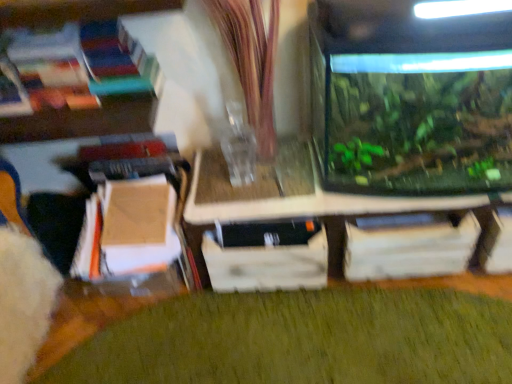
You are a GUI agent. You are given a task and a screenshot of the screen. Output one action in this format:
    pyautogui.click(x=<x>, y=<y>)
    Task: Click on the empty space that is ontop of wooden drawer at center (from a real-world perspective)
    This screenshot has height=384, width=512.
    Given the screenshot: What is the action you would take?
    pyautogui.click(x=270, y=210)